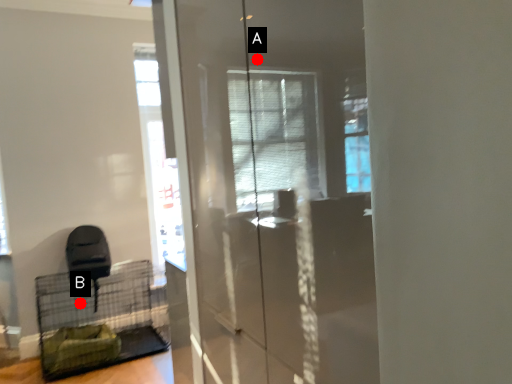
Question: Two points are circled on the image, labeled by A and B beside each circle. Among these points, which one is farthest from the camera?

Choices:
 (A) A is further
 (B) B is further

Answer: (B)